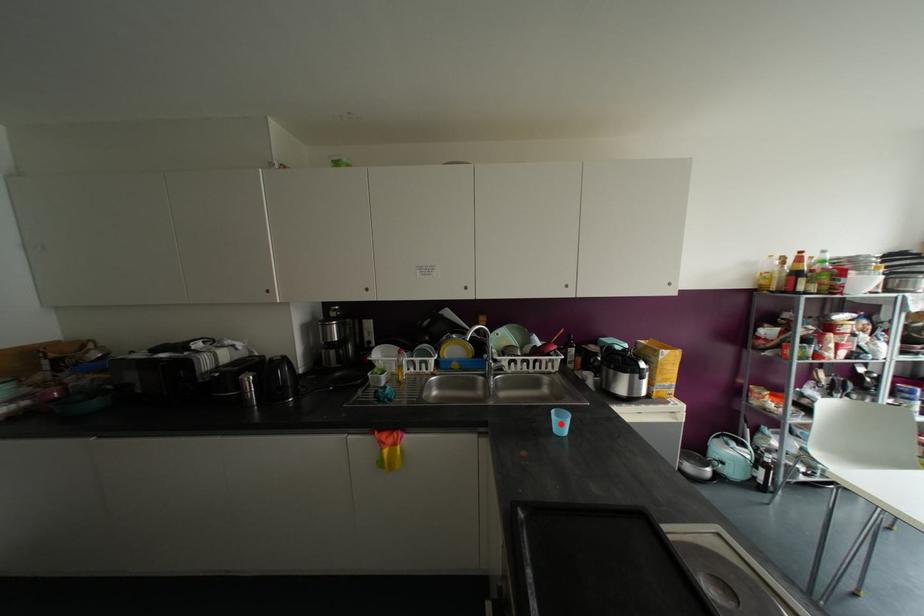
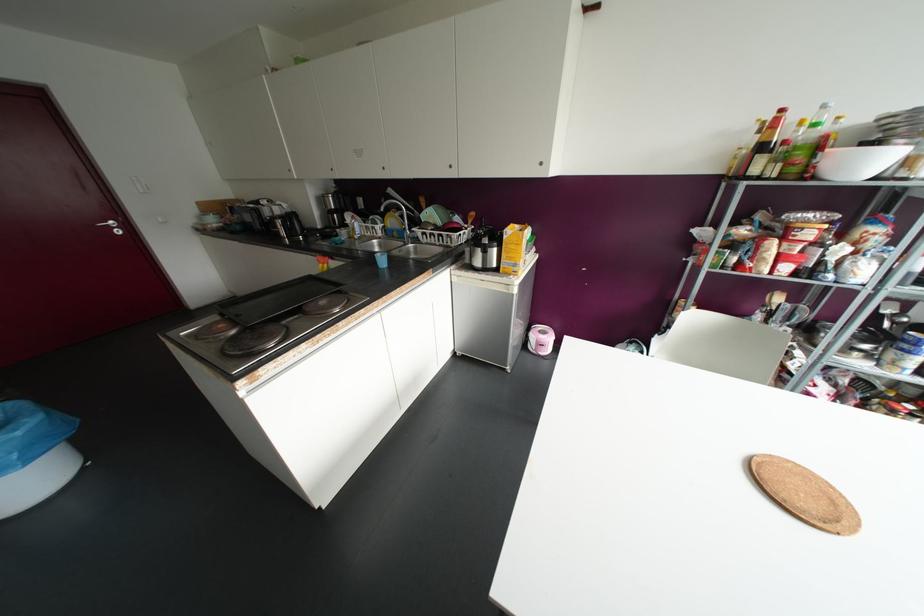
Find the pixel in the second image that matches the highlighted location in the first image.

(382, 261)